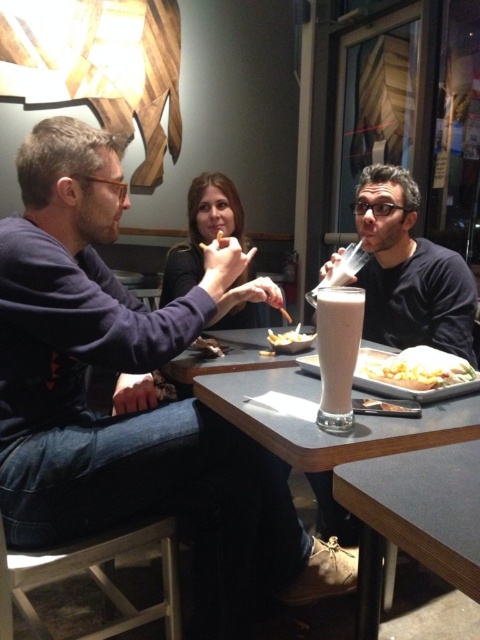
Question: Observing the image, what is the correct spatial positioning of matte black shirt at center in reference to golden crispy fries at table center?

Choices:
 (A) above
 (B) below

Answer: (A)

Question: Among these objects, which one is farthest from the camera?

Choices:
 (A) matte plastic cup at right
 (B) matte black shirt at left

Answer: (A)

Question: Is matte black shirt at left positioned behind matte black shirt at center?

Choices:
 (A) yes
 (B) no

Answer: (B)

Question: Which object appears closest to the camera in this image?

Choices:
 (A) milky white glass at center
 (B) golden crispy fries at table center
 (C) matte black shirt at center

Answer: (A)

Question: Is the position of milky white glass at center more distant than that of shiny silver spoon at lower center?

Choices:
 (A) no
 (B) yes

Answer: (A)

Question: Among these points, which one is nearest to the camera?

Choices:
 (A) (324, 429)
 (B) (135, 408)
 (C) (379, 435)

Answer: (C)